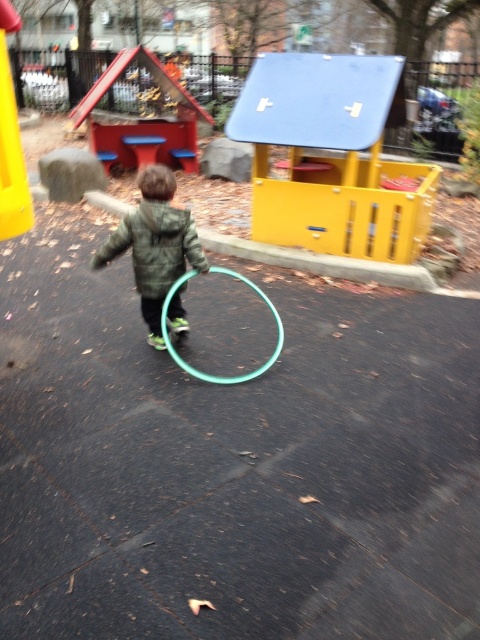
Question: Does yellow matte playhouse at center appear on the left side of red painted wooden playhouse at upper left?

Choices:
 (A) no
 (B) yes

Answer: (A)

Question: Which object appears farthest from the camera in this image?

Choices:
 (A) green matte jacket at center
 (B) red painted wooden playhouse at upper left
 (C) yellow matte slide at upper left

Answer: (B)

Question: In this image, where is yellow matte playhouse at center located relative to green matte jacket at center?

Choices:
 (A) left
 (B) right

Answer: (B)

Question: Is yellow matte playhouse at center further to the viewer compared to red painted wooden playhouse at upper left?

Choices:
 (A) yes
 (B) no

Answer: (B)

Question: Among these objects, which one is farthest from the camera?

Choices:
 (A) yellow matte slide at upper left
 (B) yellow matte playhouse at center
 (C) green matte jacket at center
 (D) teal rubber hula hoop at center

Answer: (B)

Question: Among these objects, which one is nearest to the camera?

Choices:
 (A) yellow matte slide at upper left
 (B) teal rubber hula hoop at center

Answer: (A)